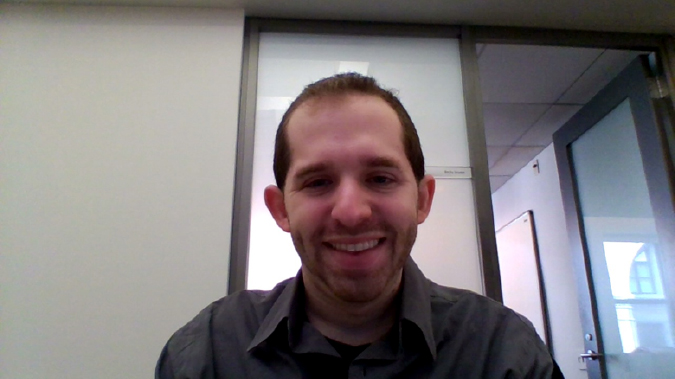
Locate an element on the screen. The height and width of the screenshot is (379, 675). wall is located at coordinates (73, 239).